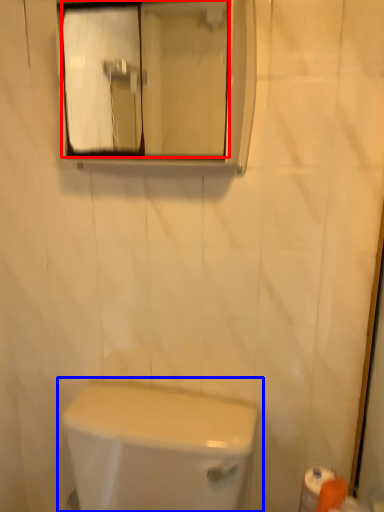
Question: Which object appears farthest to the camera in this image, mirror (highlighted by a red box) or toilet (highlighted by a blue box)?

Choices:
 (A) mirror
 (B) toilet

Answer: (A)